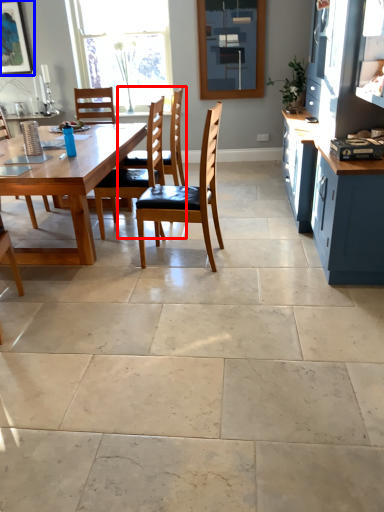
Question: Which object appears closest to the camera in this image, chair (highlighted by a red box) or picture frame (highlighted by a blue box)?

Choices:
 (A) chair
 (B) picture frame

Answer: (A)